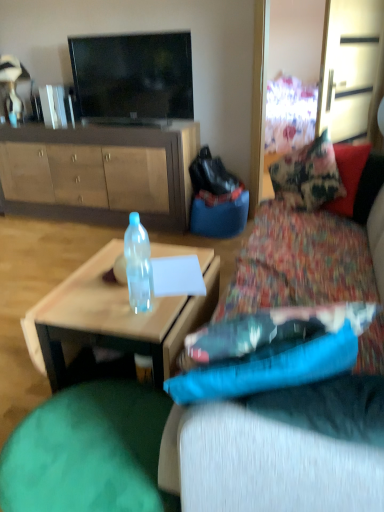
Identify the location of vacant space situated above green fabric bean bag at lower left (from a real-world perspective). Image resolution: width=384 pixels, height=512 pixels. (90, 443).